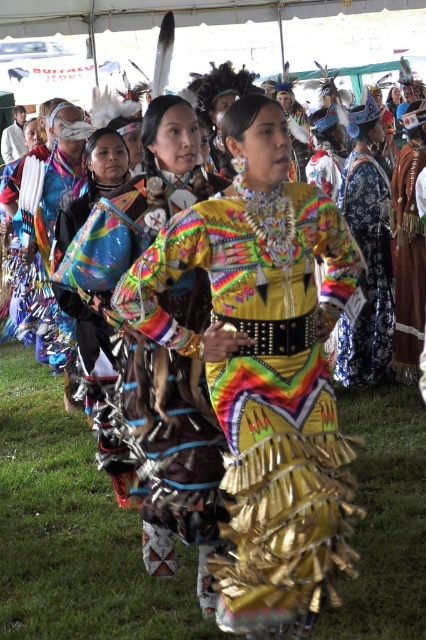
Question: Which point is closer to the camera taking this photo?

Choices:
 (A) (356, 384)
 (B) (60, 332)
 (C) (23, 145)
 (D) (213, 561)

Answer: (D)

Question: Where is multicolored fabric headdress at upper left located in relation to shiny metallic bag at center in the image?

Choices:
 (A) right
 (B) left

Answer: (B)

Question: Can you confirm if multicolored fabric dress at center is wider than shiny metallic dress at center?

Choices:
 (A) yes
 (B) no

Answer: (A)

Question: Based on their relative distances, which object is nearer to the multicolored fabric dress at center?

Choices:
 (A) multicolored sequined dress at center
 (B) brown leather belt at center

Answer: (A)

Question: Which of the following is the farthest from the observer?

Choices:
 (A) (365, 104)
 (B) (287, 620)
 (C) (5, 163)

Answer: (C)

Question: Does multicolored fabric dress at center appear under shiny metallic dress at center?

Choices:
 (A) no
 (B) yes

Answer: (B)